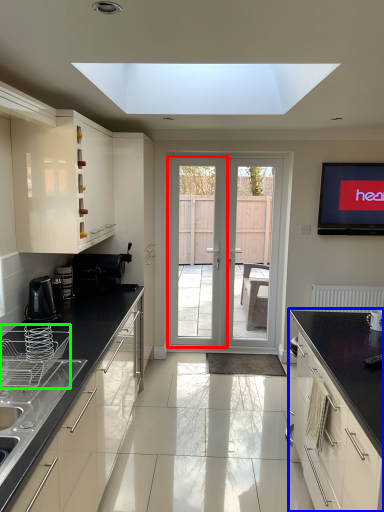
Question: Based on their relative distances, which object is farther from screen door (highlighted by a red box)? Choose from cabinetry (highlighted by a blue box) and appliance (highlighted by a green box).

Choices:
 (A) cabinetry
 (B) appliance

Answer: (B)